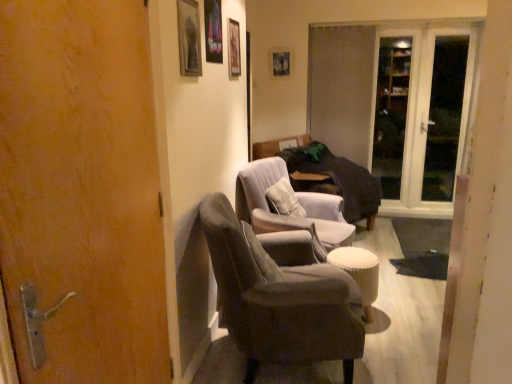
This screenshot has width=512, height=384. What are the coordinates of `vacant area on top of matte glass screen door at center, the 1th screen door viewed from the left (from a real-world perspective)` in the screenshot? It's located at (346, 24).